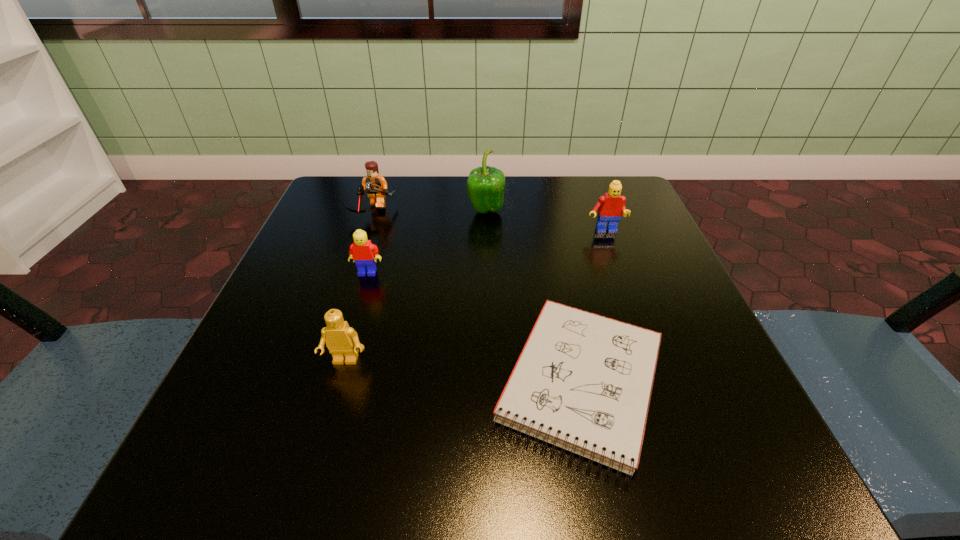
Locate an element on the screen. This screenshot has width=960, height=540. the fourth closest Lego to the shortest object is located at coordinates (376, 186).

You are a GUI agent. You are given a task and a screenshot of the screen. Output one action in this format:
    pyautogui.click(x=<x>, y=<y>)
    Task: Click on the free spot that satisfies the following two spatial constraints: 1. holding a crossbow in the hands of the farthest Lego; 2. on the left side of the notepad
    The height and width of the screenshot is (540, 960).
    Given the screenshot: What is the action you would take?
    pyautogui.click(x=315, y=382)

Locate an element on the screen. This screenshot has width=960, height=540. vacant area that satisfies the following two spatial constraints: 1. holding a crossbow in the hands of the farthest Lego; 2. on the right side of the notepad is located at coordinates (315, 382).